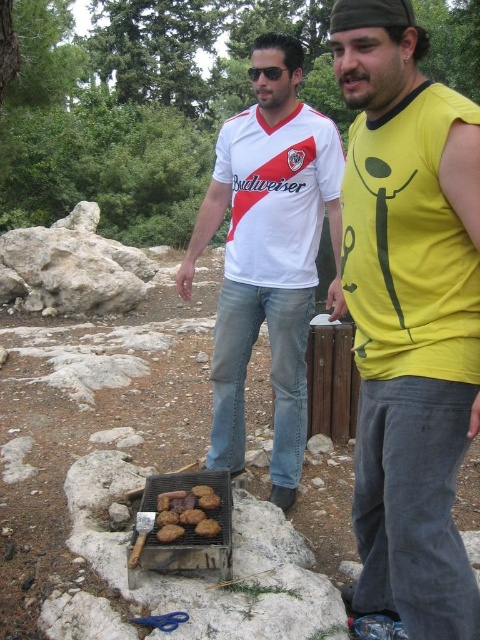
Question: Which of the following is the farthest from the observer?

Choices:
 (A) (356, 401)
 (B) (172, 492)

Answer: (A)

Question: Is white jersey at center to the right of charcoal grill at center from the viewer's perspective?

Choices:
 (A) yes
 (B) no

Answer: (A)

Question: Is white jersey at center positioned at the back of charcoal grill at center?

Choices:
 (A) no
 (B) yes

Answer: (B)

Question: Is brown wooden fence at center thinner than brown crumbly cookies at center?

Choices:
 (A) no
 (B) yes

Answer: (A)

Question: Which point is farther from the camera taking this photo?

Choices:
 (A) (288, 452)
 (B) (347, 433)

Answer: (B)

Question: Which point is closer to the camera taking this photo?

Choices:
 (A) (175, 500)
 (B) (222, 324)
 (C) (188, 497)

Answer: (A)